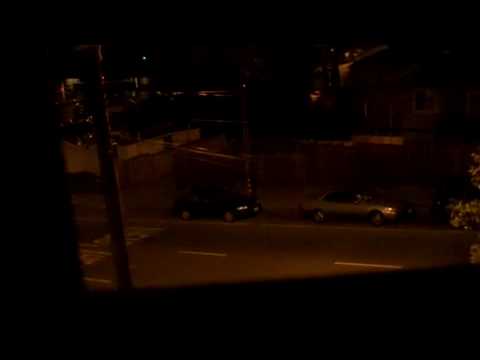
The image size is (480, 360). Identify the location of cable. (219, 158), (135, 141).